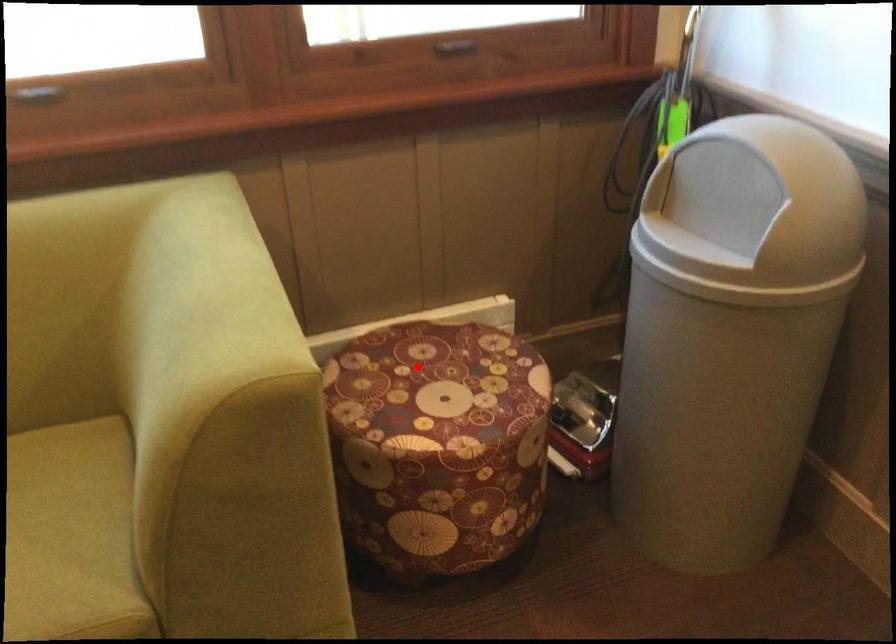
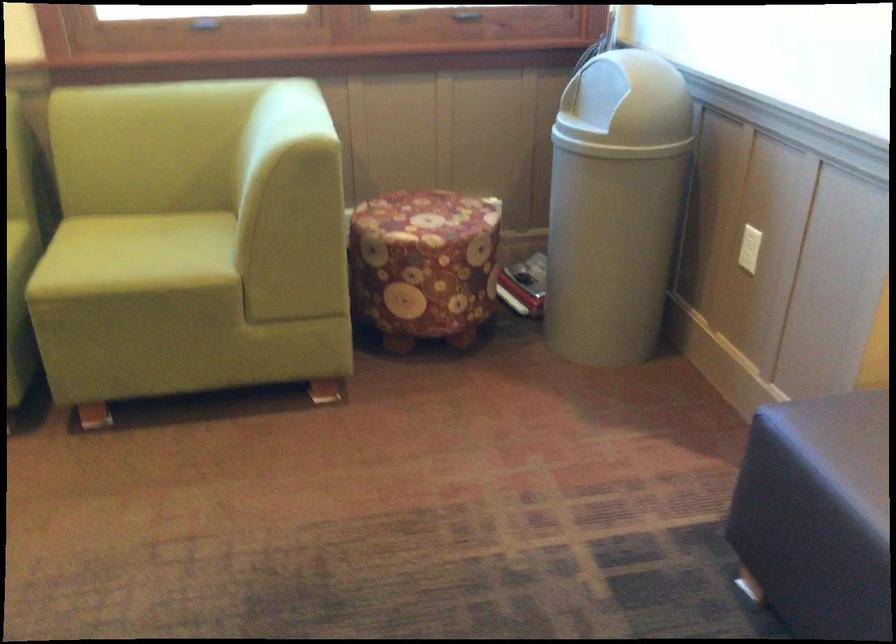
In the second image, find the point that corresponds to the highlighted location in the first image.

(414, 207)